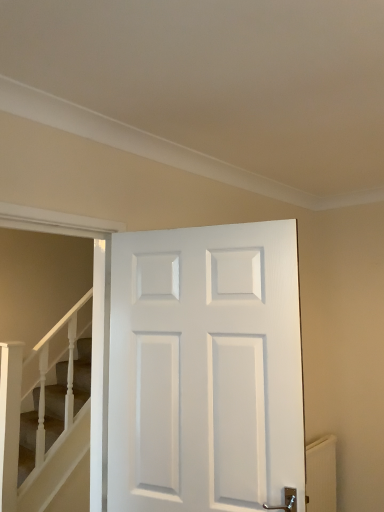
Question: Is smooth beige carpet at lower left thinner than white matte door at center?

Choices:
 (A) no
 (B) yes

Answer: (B)

Question: From a real-world perspective, does smooth beige carpet at lower left stand above white matte door at center?

Choices:
 (A) no
 (B) yes

Answer: (A)

Question: From the image's perspective, is smooth beige carpet at lower left over white matte door at center?

Choices:
 (A) no
 (B) yes

Answer: (A)

Question: Is the depth of smooth beige carpet at lower left less than that of white matte door at center?

Choices:
 (A) no
 (B) yes

Answer: (A)

Question: Is smooth beige carpet at lower left aimed at white matte door at center?

Choices:
 (A) yes
 (B) no

Answer: (A)

Question: From a real-world perspective, is smooth beige carpet at lower left positioned under white matte door at center based on gravity?

Choices:
 (A) yes
 (B) no

Answer: (A)

Question: Does white matte door at center have a lesser height compared to smooth beige carpet at lower left?

Choices:
 (A) yes
 (B) no

Answer: (A)

Question: From the image's perspective, would you say white matte door at center is shown under smooth beige carpet at lower left?

Choices:
 (A) yes
 (B) no

Answer: (B)

Question: Does white matte door at center appear on the left side of smooth beige carpet at lower left?

Choices:
 (A) yes
 (B) no

Answer: (B)

Question: From the image's perspective, is white matte door at center on smooth beige carpet at lower left?

Choices:
 (A) no
 (B) yes

Answer: (B)

Question: Are white matte door at center and smooth beige carpet at lower left beside each other?

Choices:
 (A) yes
 (B) no

Answer: (B)

Question: Is the depth of white matte door at center less than that of smooth beige carpet at lower left?

Choices:
 (A) yes
 (B) no

Answer: (A)

Question: Can you confirm if white textured radiator at lower right is smaller than white matte door at center?

Choices:
 (A) no
 (B) yes

Answer: (B)